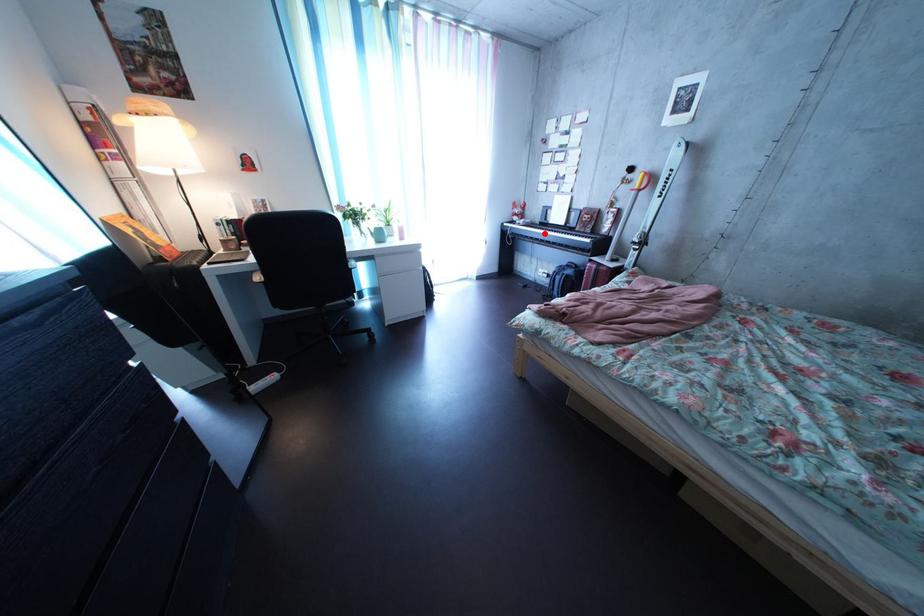
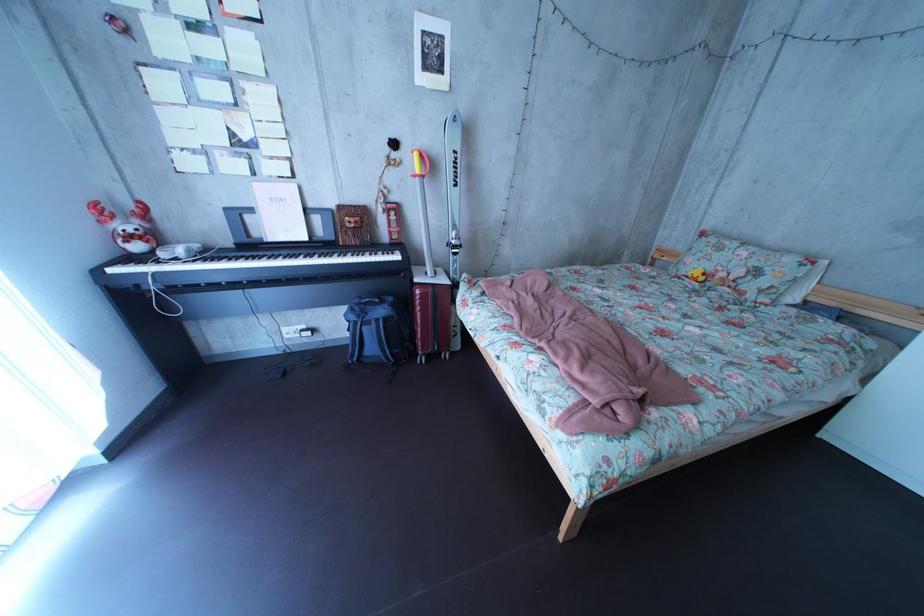
Question: A red point is marked in image1. In image2, is the corresponding 3D point closer to the camera or farther? Reply with the corresponding letter.

Choices:
 (A) The corresponding 3D point is closer.
 (B) The corresponding 3D point is farther.

Answer: (A)